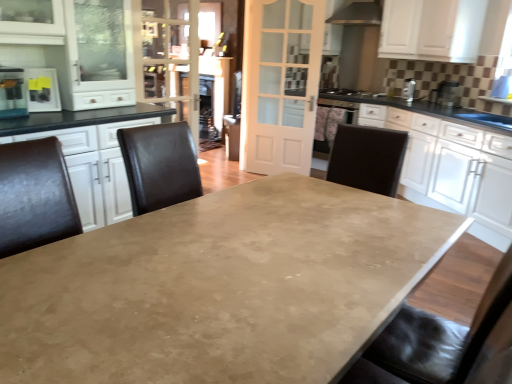
Question: From a real-world perspective, is white glossy cabinet at right, marked as the second cabinetry in a top-to-bottom arrangement, above or below black leather chairs at left?

Choices:
 (A) below
 (B) above

Answer: (A)

Question: Is white glossy cabinet at right, which appears as the 1th cabinetry when ordered from the bottom, in front of or behind black leather chairs at left in the image?

Choices:
 (A) front
 (B) behind

Answer: (B)

Question: Which object is positioned closest to the metallic silver toaster at upper right, the second appliance from the front?

Choices:
 (A) black leather swivel chair at right
 (B) white glass door at center
 (C) black matte gas stove at upper right
 (D) clear glass door at upper center
 (E) metallic silver toaster at upper right, arranged as the 2th appliance when viewed from the right

Answer: (E)

Question: Which is farther from the white glass door at center?

Choices:
 (A) matte concrete table at center
 (B) metallic silver toaster at upper right, arranged as the 2th appliance when viewed from the right
 (C) matte black toaster at left, marked as the 1th appliance in a left-to-right arrangement
 (D) metallic silver toaster at upper right, which ranks as the 2th appliance in top-to-bottom order
 (E) metallic stainless steel at upper center

Answer: (A)